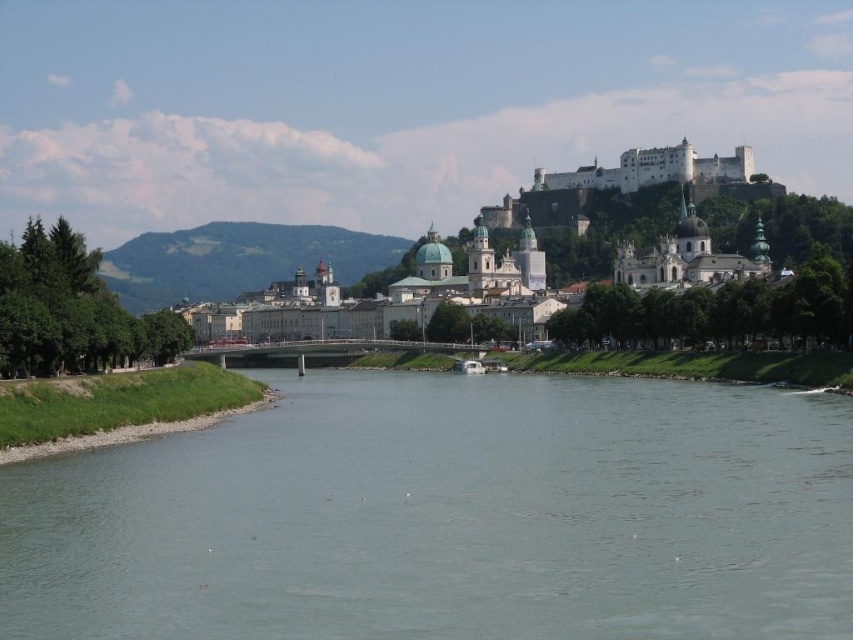
You are a tourist standing on the Salzach River bridge and looking at the clear water at center and the white stone church at center. Which object appears closer to you based on their positions in the scene?

The clear water at center appears closer to you because it is shorter than the white stone church at center, which means it is positioned lower in the visual plane.

You are standing at point [447,516] in the image of Salzburg. What can you see directly in front of you?

At point [447,516] lies clear water at center.